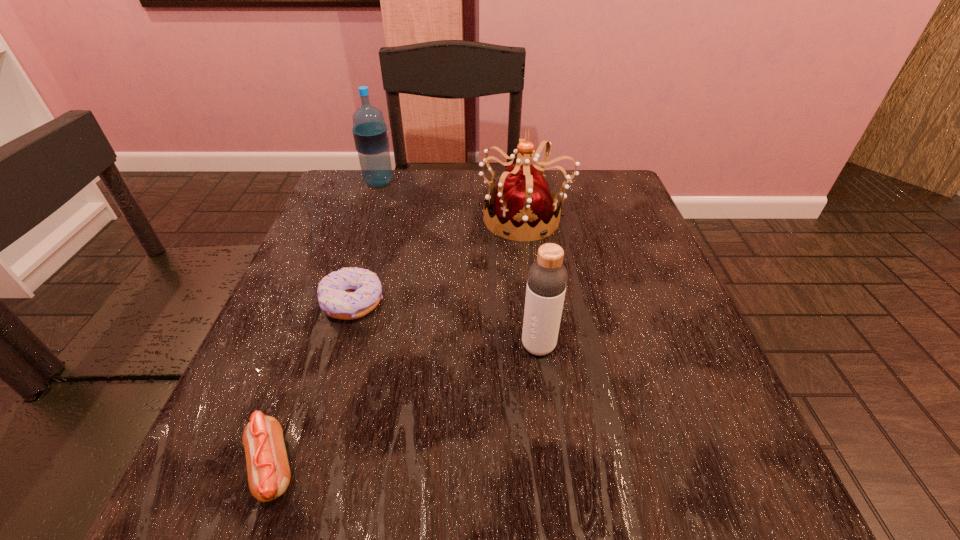
Find the location of a particular element. This screenshot has height=540, width=960. vacant position located 0.060m on the front of the doughnut is located at coordinates (338, 354).

The image size is (960, 540). Identify the location of blank space located 0.350m on the back of the sausage. (342, 268).

Where is `water bottle that is at the far edge`? water bottle that is at the far edge is located at coordinates (370, 132).

The width and height of the screenshot is (960, 540). I want to click on tiara positioned at the far edge, so click(523, 204).

Where is `object situated at the near edge`? Image resolution: width=960 pixels, height=540 pixels. object situated at the near edge is located at coordinates (268, 469).

Find the location of a particular element. This screenshot has width=960, height=540. water bottle located at the left edge is located at coordinates (370, 132).

Image resolution: width=960 pixels, height=540 pixels. What are the coordinates of `doughnut present at the left edge` in the screenshot? It's located at (350, 293).

In order to click on sausage that is at the left edge in this screenshot , I will do `click(268, 469)`.

Locate an element on the screen. The image size is (960, 540). object positioned at the right edge is located at coordinates (523, 204).

Identify the location of object that is at the far left corner. (370, 132).